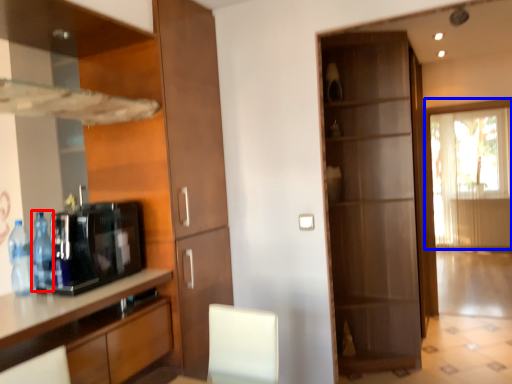
Question: Which point is closer to the camera, bottle (highlighted by a red box) or window (highlighted by a blue box)?

Choices:
 (A) bottle
 (B) window

Answer: (A)